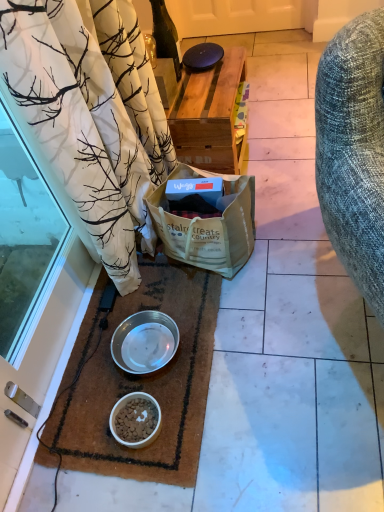
The image size is (384, 512). Identify the location of empty space that is to the right of brown woven mat at lower left. (288, 337).